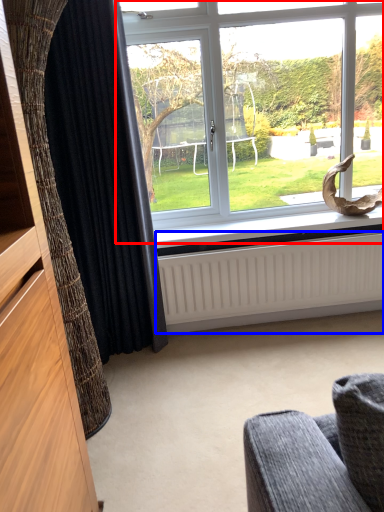
Question: Which object appears closest to the camera in this image, window (highlighted by a red box) or radiator (highlighted by a blue box)?

Choices:
 (A) window
 (B) radiator

Answer: (A)